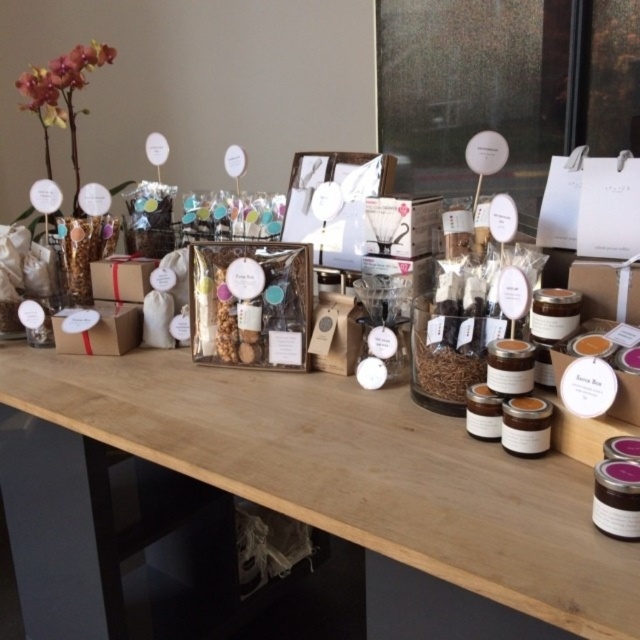
You are setting up a display for a craft fair and have a wooden table at center and a translucent glass jar at center. Which object should you place first if you want to ensure there is enough space for both?

You should place the wooden table at center first since it is larger in size than the translucent glass jar at center, ensuring there is enough space for both.

You are a customer at the artisanal products display. You see the wooden table at center and the matte brown jar at center. Which object is closer to the top edge of the image?

The matte brown jar at center is closer to the top edge of the image because the wooden table at center is located below it.

You are a customer trying to place a translucent glass jar at center and a matte brown jar at center into a gift box that can only accommodate items within 10 inches of each other. Will the two jars fit together in the box?

The translucent glass jar at center is 10.17 inches away from the matte brown jar at center. Since the distance between them exceeds the 10 inches limit, the jars cannot fit together in the box.